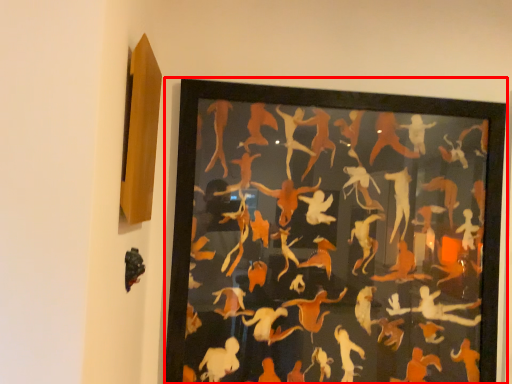
Question: From the image's perspective, considering the relative positions of picture frame (annotated by the red box) and animal in the image provided, where is picture frame (annotated by the red box) located with respect to the staircase?

Choices:
 (A) above
 (B) below

Answer: (A)